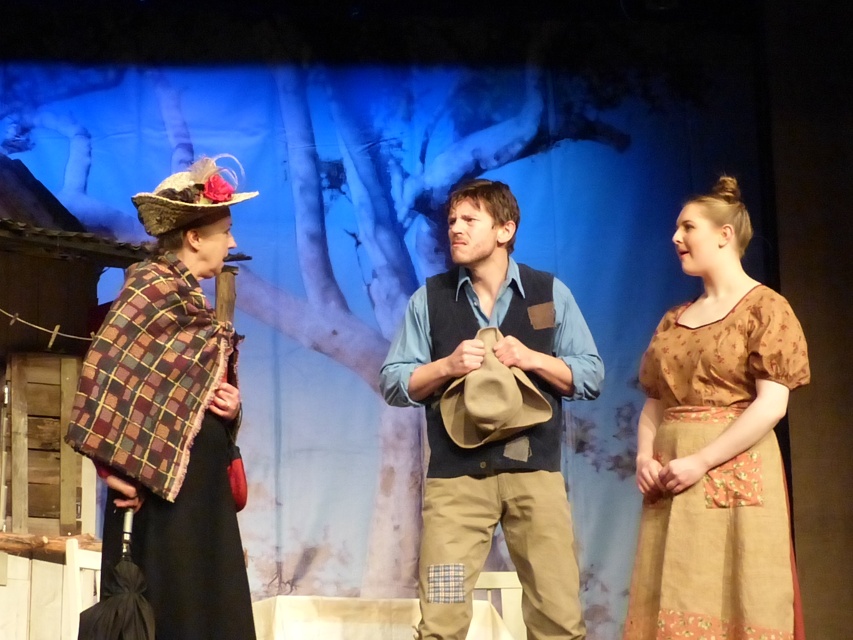
Question: Which object appears farthest from the camera in this image?

Choices:
 (A) floral cotton dress at right
 (B) plaid fabric shawl at left

Answer: (A)

Question: Which object is farther from the camera taking this photo?

Choices:
 (A) denim vest at center
 (B) plaid fabric shawl at left

Answer: (A)

Question: Which of these objects is positioned farthest from the plaid fabric shawl at left?

Choices:
 (A) denim vest at center
 (B) floral cotton dress at right

Answer: (B)

Question: Does plaid fabric shawl at left lie behind denim vest at center?

Choices:
 (A) yes
 (B) no

Answer: (B)

Question: In this image, where is plaid fabric shawl at left located relative to denim vest at center?

Choices:
 (A) above
 (B) below

Answer: (A)

Question: Does floral cotton dress at right come behind plaid fabric shawl at left?

Choices:
 (A) no
 (B) yes

Answer: (B)